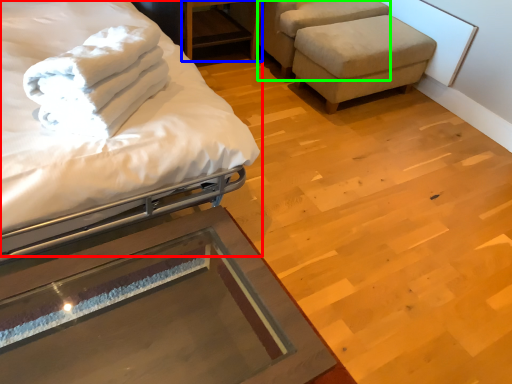
Question: Which object is the farthest from bed (highlighted by a red box)? Choose among these: table (highlighted by a blue box) or swivel chair (highlighted by a green box).

Choices:
 (A) table
 (B) swivel chair

Answer: (B)